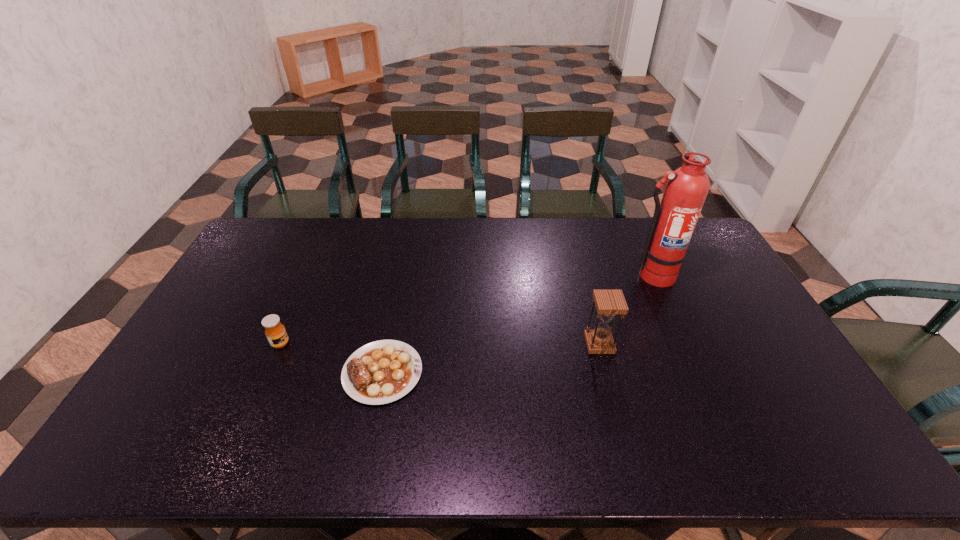
Find the location of a particular element. vacant area that satisfies the following two spatial constraints: 1. on the front-facing side of the second shortest object; 2. on the left side of the third object from right to left is located at coordinates (268, 373).

Find the location of a particular element. The height and width of the screenshot is (540, 960). vacant point that satisfies the following two spatial constraints: 1. on the label side of the fire extinguisher; 2. on the front-facing side of the second shortest object is located at coordinates (684, 343).

Find the location of a particular element. The image size is (960, 540). free region that satisfies the following two spatial constraints: 1. on the label side of the fire extinguisher; 2. on the front-facing side of the leftmost object is located at coordinates (684, 343).

This screenshot has height=540, width=960. What are the coordinates of `vacant region that satisfies the following two spatial constraints: 1. on the front-facing side of the honey; 2. on the right side of the shortest object` in the screenshot? It's located at (268, 373).

I want to click on free space in the image that satisfies the following two spatial constraints: 1. on the front-facing side of the honey; 2. on the back side of the hourglass, so click(280, 344).

I want to click on free space that satisfies the following two spatial constraints: 1. on the front-facing side of the third tallest object; 2. on the left side of the second tallest object, so click(x=280, y=344).

Where is `vacant space that satisfies the following two spatial constraints: 1. on the front-facing side of the third tallest object; 2. on the right side of the hourglass`? Image resolution: width=960 pixels, height=540 pixels. vacant space that satisfies the following two spatial constraints: 1. on the front-facing side of the third tallest object; 2. on the right side of the hourglass is located at coordinates (280, 344).